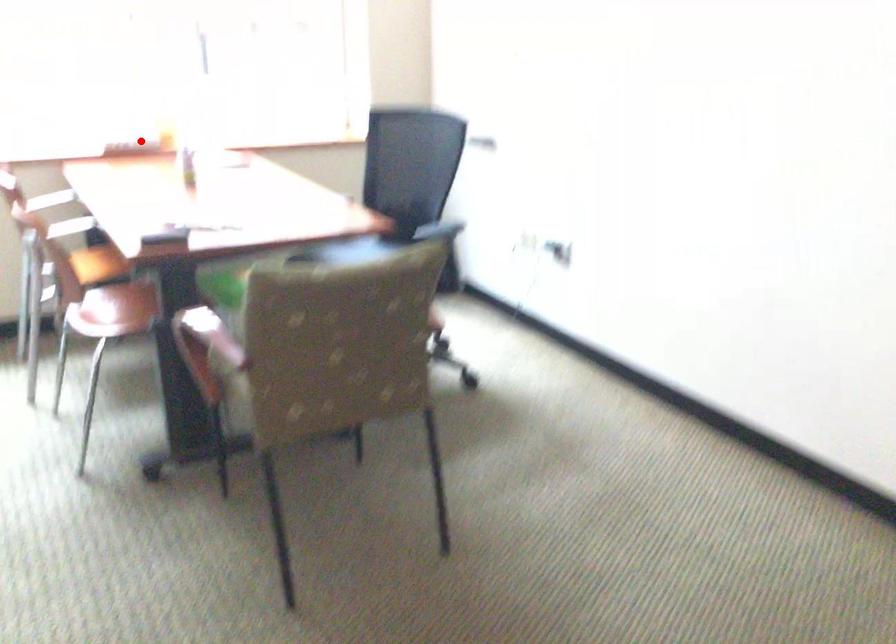
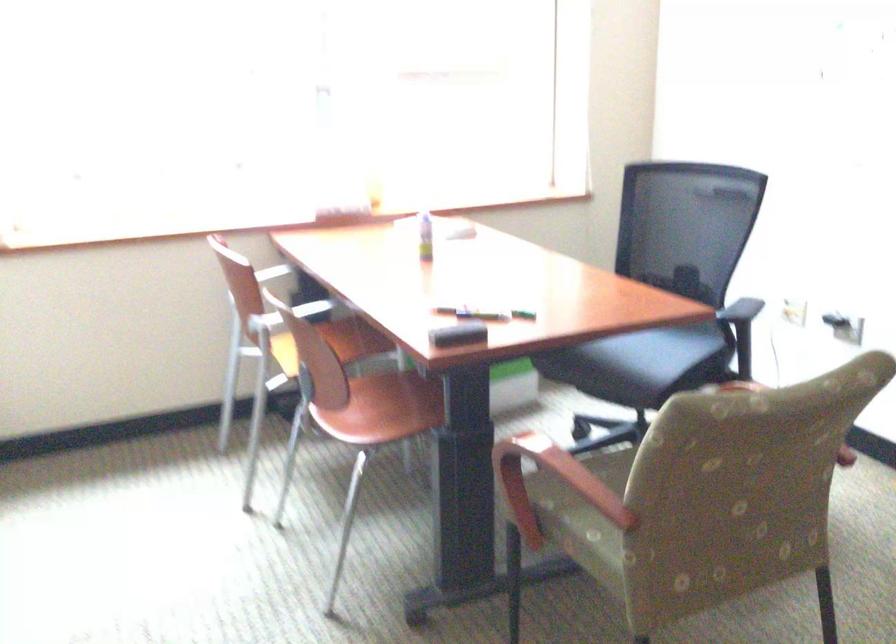
Question: I am providing you with two images of the same scene from different viewpoints. A red point is marked on the first image. At the location where the point appears in image 1, is it still visible in image 2?

Choices:
 (A) Yes
 (B) No

Answer: (A)